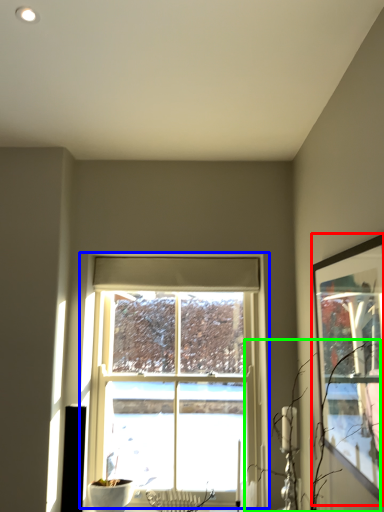
Question: Which is nearer to the picture frame (highlighted by a red box)? window (highlighted by a blue box) or branch (highlighted by a green box).

Choices:
 (A) window
 (B) branch

Answer: (B)